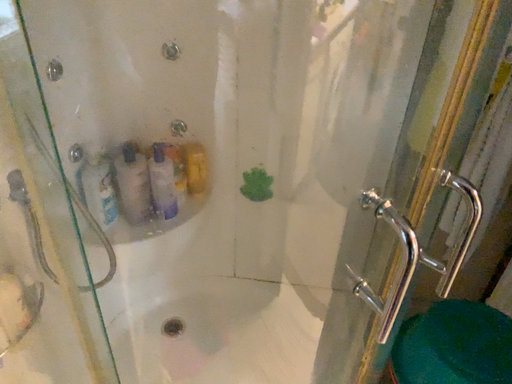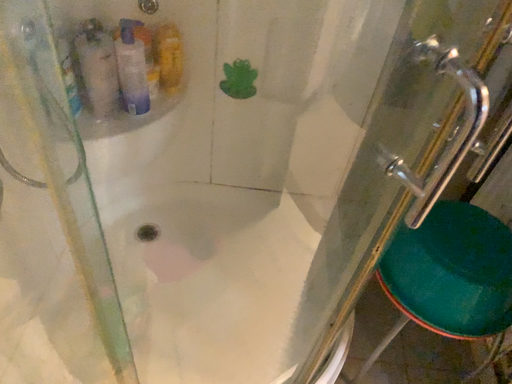
Question: Which way did the camera rotate in the video?

Choices:
 (A) rotated downward
 (B) rotated upward

Answer: (A)